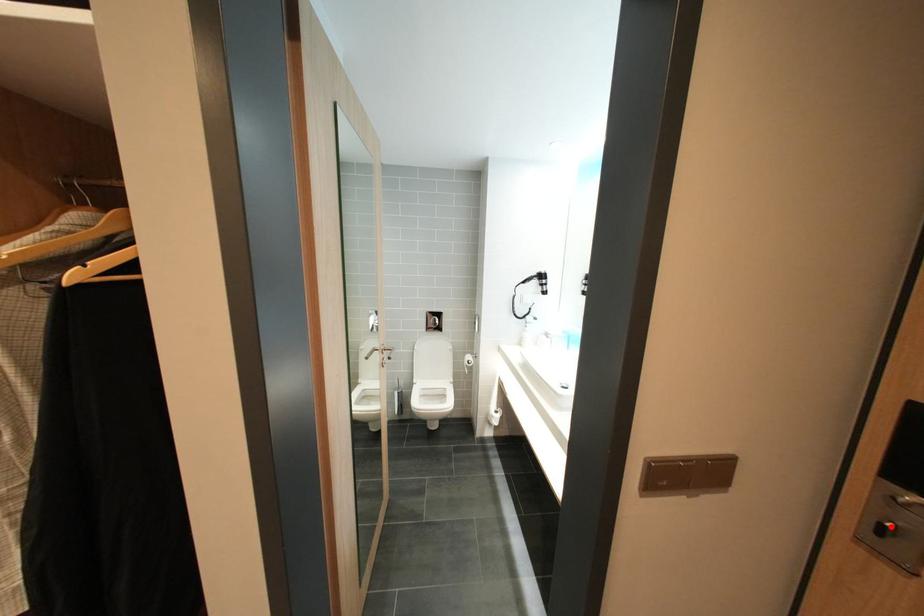
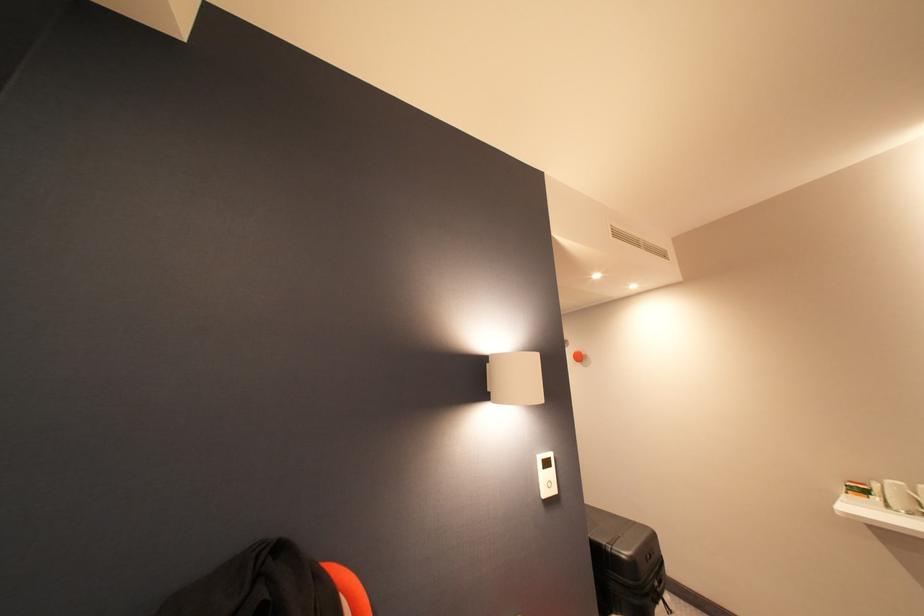
Question: I am providing you with two images of the same scene from different viewpoints. A red point is marked on the first image. Can you still see the location of the red point in image 2?

Choices:
 (A) Yes
 (B) No

Answer: (B)